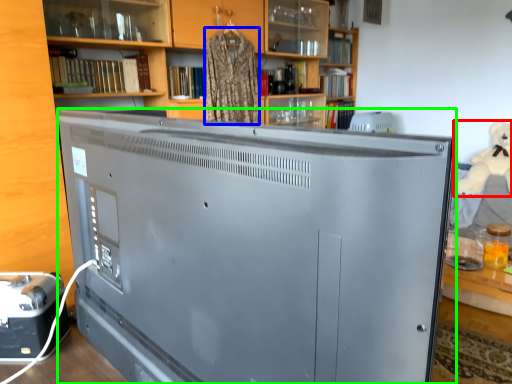
Question: Which is nearer to the toy (highlighted by a red box)? clothing (highlighted by a blue box) or television (highlighted by a green box).

Choices:
 (A) clothing
 (B) television

Answer: (A)